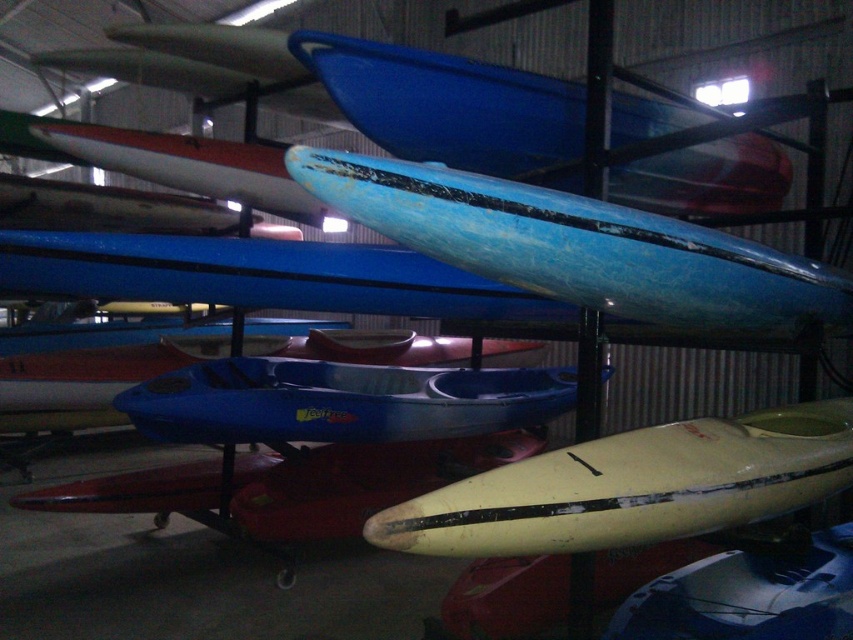
How much distance is there between blue matte kayak at center and blue plastic kayak at upper center?

blue matte kayak at center and blue plastic kayak at upper center are 24.88 inches apart.

This screenshot has height=640, width=853. Identify the location of blue matte kayak at center. (578, 246).

Is point (553, 216) farther from camera compared to point (612, 145)?

No.

This screenshot has width=853, height=640. In order to click on blue matte kayak at center in this screenshot , I will do `click(578, 246)`.

Is blue plastic kayak at upper center bigger than matte blue kayak at center?

Yes.

Is point (691, 116) farther from camera compared to point (79, 154)?

No.

Identify the location of blue plastic kayak at upper center. Image resolution: width=853 pixels, height=640 pixels. (447, 104).

Where is `blue matte kayak at center`? The width and height of the screenshot is (853, 640). blue matte kayak at center is located at coordinates (578, 246).

You are a GUI agent. You are given a task and a screenshot of the screen. Output one action in this format:
    pyautogui.click(x=<x>, y=<y>)
    Task: Click on the blue matte kayak at center
    The width and height of the screenshot is (853, 640).
    Given the screenshot: What is the action you would take?
    pyautogui.click(x=578, y=246)